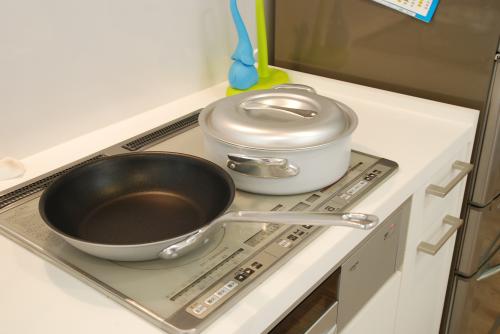
The width and height of the screenshot is (500, 334). Identify the location of side of gray refrigerator. (410, 54).